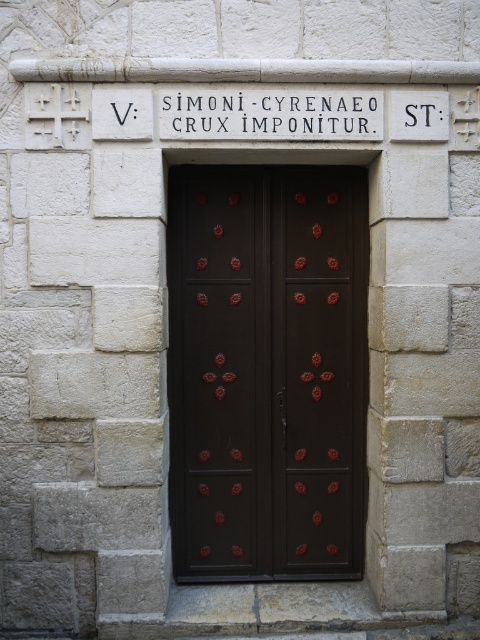
Is dark wood door at center positioned in front of white stone sign at center?

That is False.

Between dark wood door at center and white stone sign at center, which one appears on the left side from the viewer's perspective?

From the viewer's perspective, dark wood door at center appears more on the left side.

Between point (275, 481) and point (325, 118), which one is positioned in front?

Positioned in front is point (325, 118).

Where is `dark wood door at center`? The height and width of the screenshot is (640, 480). dark wood door at center is located at coordinates (266, 371).